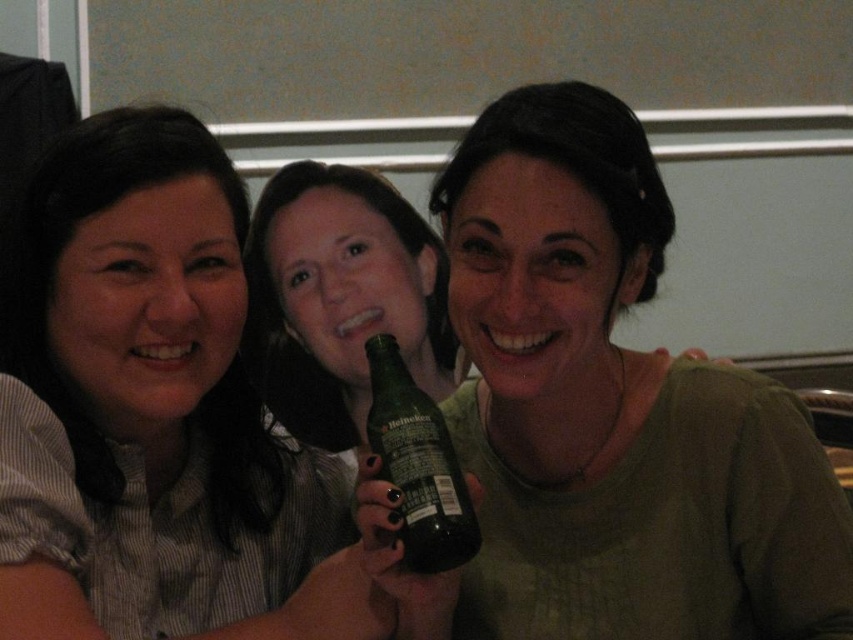
Question: Can you confirm if matte black shirt at left is wider than green glass bottle at center?

Choices:
 (A) no
 (B) yes

Answer: (B)

Question: Is matte black shirt at left to the right of green glass bottle at center from the viewer's perspective?

Choices:
 (A) yes
 (B) no

Answer: (B)

Question: Among these objects, which one is nearest to the camera?

Choices:
 (A) matte black shirt at left
 (B) green matte bottle at center

Answer: (A)

Question: Can you confirm if green matte bottle at center is thinner than green glass bottle at center?

Choices:
 (A) no
 (B) yes

Answer: (A)

Question: Considering the real-world distances, which object is farthest from the green glass bottle at center?

Choices:
 (A) green matte bottle at center
 (B) matte black shirt at left

Answer: (B)

Question: Which point is closer to the camera?

Choices:
 (A) (190, 401)
 (B) (779, 512)

Answer: (B)